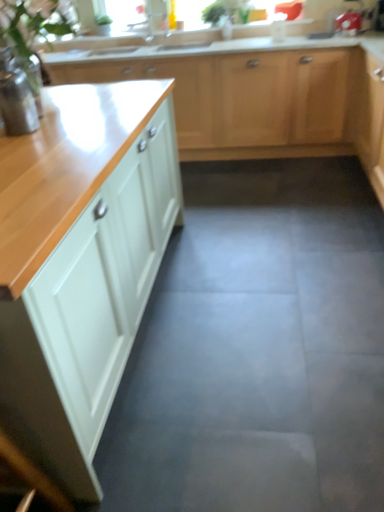
Question: Can green leafy plant at upper center be found inside white glossy cabinet at left, arranged as the first cabinetry when ordered from the bottom?

Choices:
 (A) no
 (B) yes

Answer: (A)

Question: From the image's perspective, is white glossy cabinet at left, arranged as the first cabinetry when ordered from the bottom, over green leafy plant at upper center?

Choices:
 (A) yes
 (B) no

Answer: (B)

Question: Is white glossy cabinet at left, the first cabinetry from the front, oriented towards green leafy plant at upper center?

Choices:
 (A) yes
 (B) no

Answer: (B)

Question: From the image's perspective, is white glossy cabinet at left, which is the 2th cabinetry from top to bottom, under green leafy plant at upper center?

Choices:
 (A) yes
 (B) no

Answer: (A)

Question: Does white glossy cabinet at left, which is the 2th cabinetry from top to bottom, have a lesser height compared to green leafy plant at upper center?

Choices:
 (A) no
 (B) yes

Answer: (A)

Question: From a real-world perspective, is matte white cabinets at upper center, which is the second cabinetry in front-to-back order, above or below white glossy cabinet at left, which is the 2th cabinetry from top to bottom?

Choices:
 (A) above
 (B) below

Answer: (B)

Question: Is matte white cabinets at upper center, which ranks as the 1th cabinetry in back-to-front order, to the left or to the right of white glossy cabinet at left, the first cabinetry from the front, in the image?

Choices:
 (A) left
 (B) right

Answer: (B)

Question: Is point (244, 92) positioned closer to the camera than point (69, 215)?

Choices:
 (A) farther
 (B) closer

Answer: (A)

Question: From their relative heights in the image, would you say matte white cabinets at upper center, which is the second cabinetry in front-to-back order, is taller or shorter than white glossy cabinet at left, arranged as the first cabinetry when ordered from the bottom?

Choices:
 (A) tall
 (B) short

Answer: (B)

Question: Considering the positions of matte white cabinets at upper center, which is the second cabinetry in front-to-back order, and gray concrete floor at center in the image, is matte white cabinets at upper center, which is the second cabinetry in front-to-back order, taller or shorter than gray concrete floor at center?

Choices:
 (A) tall
 (B) short

Answer: (A)

Question: Considering the positions of matte white cabinets at upper center, marked as the second cabinetry in a bottom-to-top arrangement, and gray concrete floor at center in the image, is matte white cabinets at upper center, marked as the second cabinetry in a bottom-to-top arrangement, wider or thinner than gray concrete floor at center?

Choices:
 (A) wide
 (B) thin

Answer: (B)

Question: Looking at the image, does matte white cabinets at upper center, which is counted as the first cabinetry, starting from the top, seem bigger or smaller compared to gray concrete floor at center?

Choices:
 (A) small
 (B) big

Answer: (A)

Question: From the image's perspective, relative to gray concrete floor at center, is matte white cabinets at upper center, marked as the second cabinetry in a bottom-to-top arrangement, above or below?

Choices:
 (A) above
 (B) below

Answer: (A)

Question: Is white glossy cabinet at left, the first cabinetry from the front, in front of or behind matte white cabinets at upper center, marked as the second cabinetry in a bottom-to-top arrangement, in the image?

Choices:
 (A) behind
 (B) front

Answer: (B)

Question: From a real-world perspective, is white glossy cabinet at left, arranged as the first cabinetry when ordered from the bottom, positioned above or below matte white cabinets at upper center, marked as the second cabinetry in a bottom-to-top arrangement?

Choices:
 (A) below
 (B) above

Answer: (B)